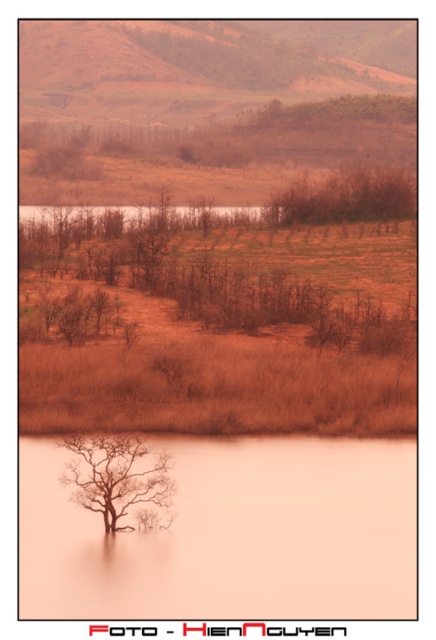
Is translucent orange flood at center further to camera compared to brown matte tree at center?

No, translucent orange flood at center is closer to the viewer.

Between translucent orange flood at center and brown matte tree at center, which one appears on the left side from the viewer's perspective?

Positioned to the left is translucent orange flood at center.

Which is behind, point (152, 579) or point (302, 182)?

The point (302, 182) is behind.

This screenshot has width=436, height=640. Identify the location of translucent orange flood at center. (231, 534).

Between brown matte tree at lower center and brown matte tree at center, which one is positioned lower?

brown matte tree at lower center

What do you see at coordinates (119, 481) in the screenshot? I see `brown matte tree at lower center` at bounding box center [119, 481].

The width and height of the screenshot is (436, 640). What are the coordinates of `brown matte tree at lower center` in the screenshot? It's located at [x=119, y=481].

Who is positioned more to the left, brown grassland at center or brown matte tree at lower center?

From the viewer's perspective, brown matte tree at lower center appears more on the left side.

Can you confirm if brown grassland at center is bigger than brown matte tree at lower center?

Correct, brown grassland at center is larger in size than brown matte tree at lower center.

Identify the location of brown grassland at center. (214, 324).